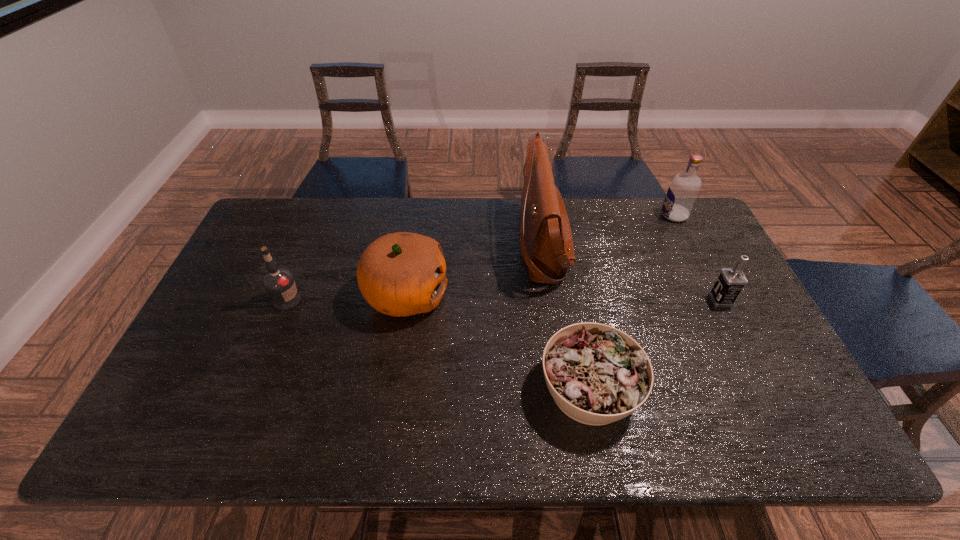
The width and height of the screenshot is (960, 540). I want to click on vacant area in the image that satisfies the following two spatial constraints: 1. on the front label of the leftmost object; 2. on the left side of the shortest object, so click(252, 389).